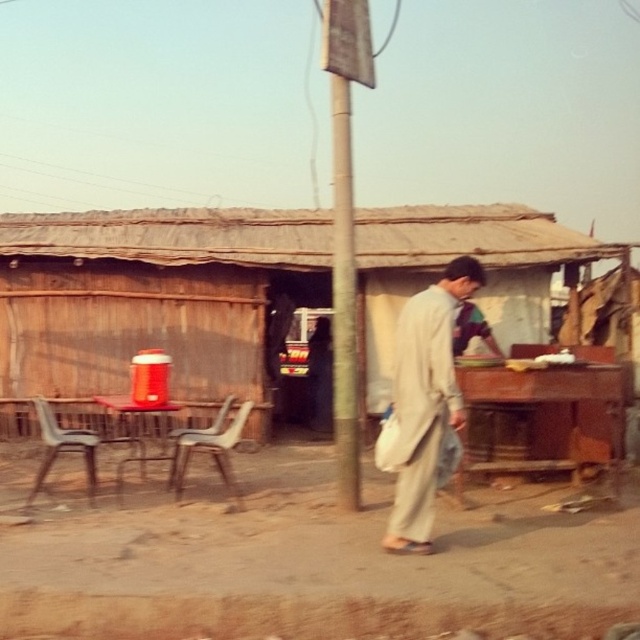
Who is taller, metallic pole at center or plastic/grey chair at left?

Standing taller between the two is plastic/grey chair at left.

Between point (340, 340) and point (52, 436), which one is positioned behind?

The point (52, 436) is behind.

Is point (349, 353) farther from viewer compared to point (33, 493)?

No, it is in front of (33, 493).

Locate an element on the screen. The width and height of the screenshot is (640, 640). metallic pole at center is located at coordinates [x=346, y=227].

Who is lower down, plastic/grey chair at left or plastic chair at center?

plastic chair at center

Which is more to the left, plastic/grey chair at left or plastic chair at center?

plastic/grey chair at left

Measure the distance between point (38, 484) and camera.

7.23 meters

Find the location of a particular element. Image resolution: width=640 pixels, height=640 pixels. plastic/grey chair at left is located at coordinates (70, 449).

Is light beige fabric robe at center smaller than metallic pole at center?

No, light beige fabric robe at center is not smaller than metallic pole at center.

Can you confirm if light beige fabric robe at center is bigger than metallic pole at center?

Correct, light beige fabric robe at center is larger in size than metallic pole at center.

Is point (468, 285) less distant than point (371, 81)?

Yes, point (468, 285) is in front of point (371, 81).

Locate an element on the screen. This screenshot has height=640, width=640. light beige fabric robe at center is located at coordinates (422, 410).